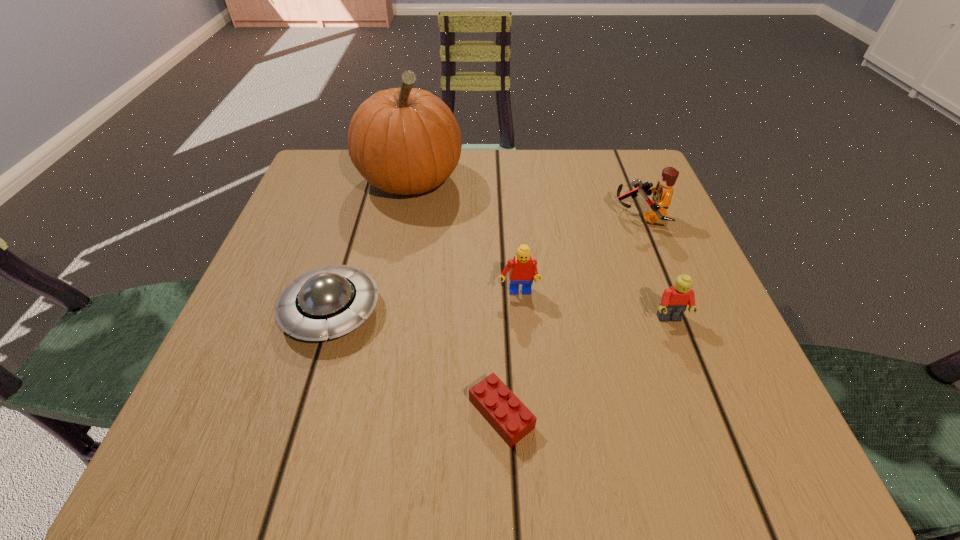
Image resolution: width=960 pixels, height=540 pixels. Find the location of `the tallest object`. the tallest object is located at coordinates (406, 140).

You are a GUI agent. You are given a task and a screenshot of the screen. Output one action in this format:
    pyautogui.click(x=<x>, y=<y>)
    Task: Click on the farthest Lego
    This screenshot has height=540, width=960.
    Given the screenshot: What is the action you would take?
    [x=662, y=193]

I want to click on the second farthest Lego, so click(x=522, y=269).

What are the coordinates of `the second nearest Lego` in the screenshot? It's located at (674, 301).

At what (x,y) coordinates should I click in order to perform the action: click on the fifth tallest object. Please return your answer as a coordinate pair (x, y). The height and width of the screenshot is (540, 960). Looking at the image, I should click on pyautogui.click(x=327, y=302).

Find the location of a particular element. the nearest Lego is located at coordinates (509, 417).

The height and width of the screenshot is (540, 960). I want to click on the shortest Lego, so click(x=509, y=417).

You are a GUI agent. You are given a task and a screenshot of the screen. Output one action in this format:
    pyautogui.click(x=<x>, y=<y>)
    Task: Click on the vacant area situated on the stem of the pumpkin
    This screenshot has height=540, width=960.
    Given the screenshot: What is the action you would take?
    pyautogui.click(x=376, y=360)

Find the location of `free location located holding a crossbow in the hands of the farthest Lego`. free location located holding a crossbow in the hands of the farthest Lego is located at coordinates (533, 216).

Where is `free region located 0.180m holding a crossbow in the hands of the farthest Lego`? The width and height of the screenshot is (960, 540). free region located 0.180m holding a crossbow in the hands of the farthest Lego is located at coordinates (528, 216).